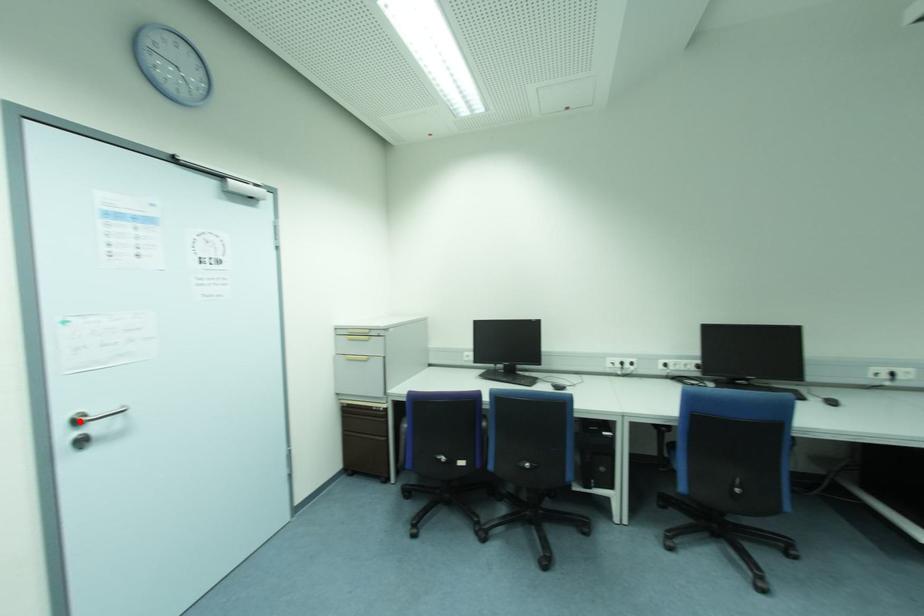
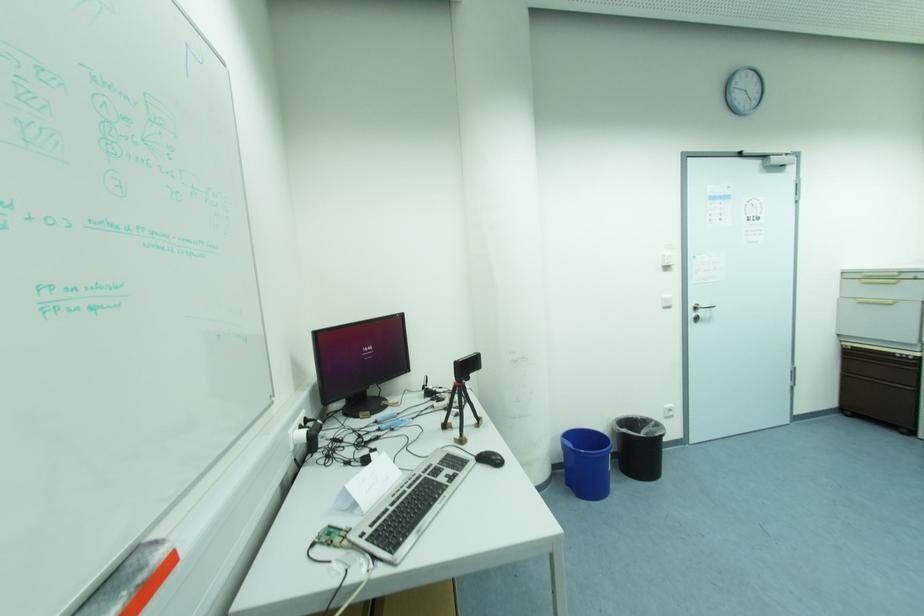
Locate, in the second image, the point that corresponds to the highlighted location in the first image.

(697, 309)